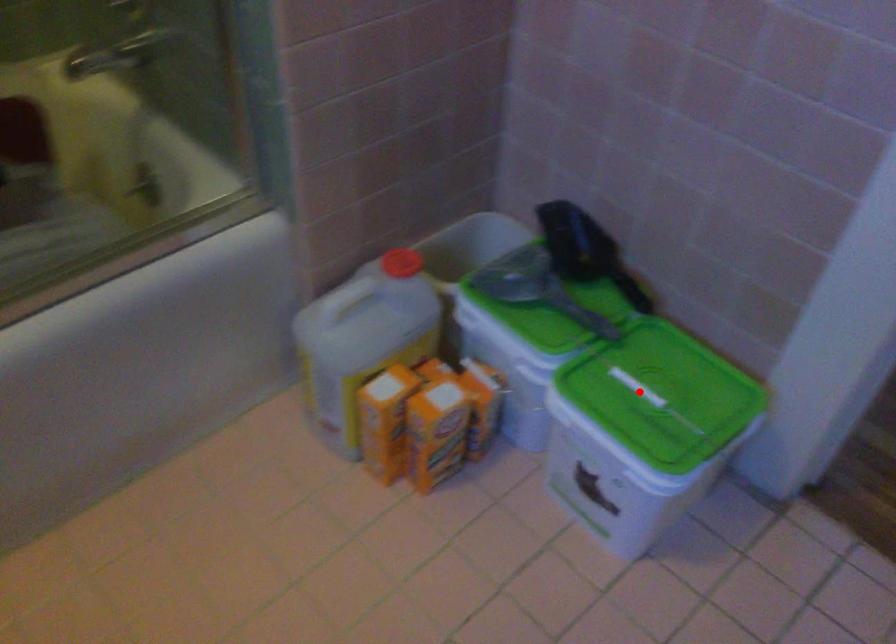
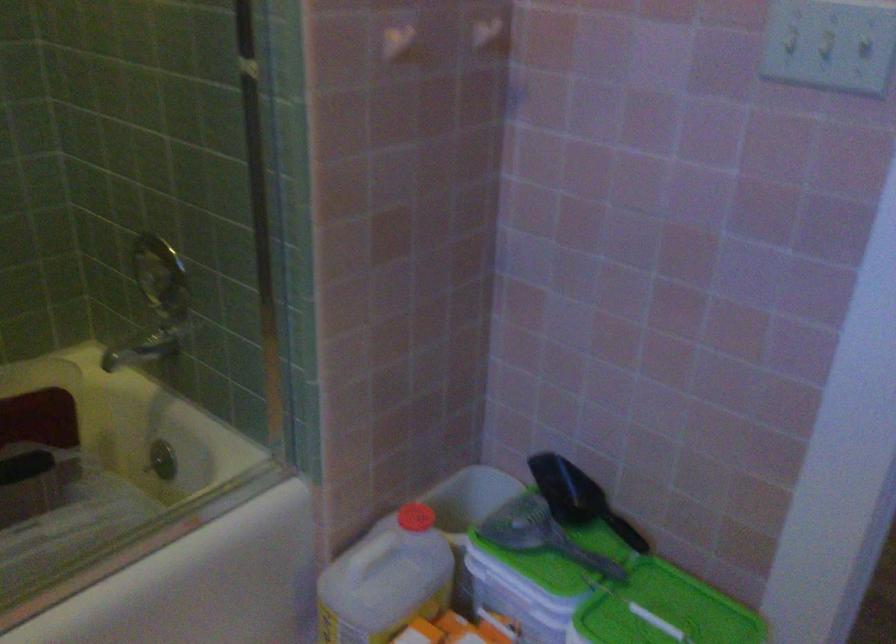
The point at the highlighted location is marked in the first image. Where is the corresponding point in the second image?

(656, 621)